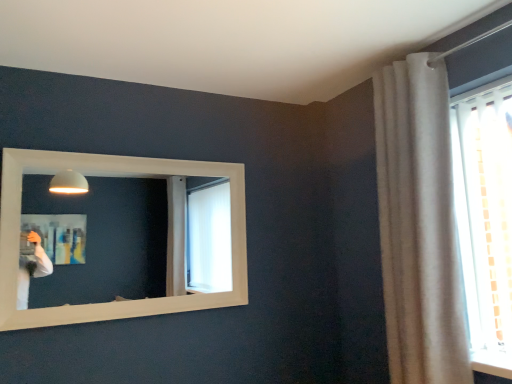
Question: Is white wooden mirror at upper left taller or shorter than white textured curtain at upper right?

Choices:
 (A) tall
 (B) short

Answer: (B)

Question: From a real-world perspective, is white wooden mirror at upper left positioned above or below white textured curtain at upper right?

Choices:
 (A) above
 (B) below

Answer: (A)

Question: Choose the correct answer: Is white wooden mirror at upper left inside white textured curtain at upper right or outside it?

Choices:
 (A) outside
 (B) inside

Answer: (A)

Question: Looking at the image, does white textured curtain at upper right seem bigger or smaller compared to white wooden mirror at upper left?

Choices:
 (A) big
 (B) small

Answer: (A)

Question: Relative to white wooden mirror at upper left, is white textured curtain at upper right in front or behind?

Choices:
 (A) front
 (B) behind

Answer: (A)

Question: From a real-world perspective, relative to white wooden mirror at upper left, is white textured curtain at upper right vertically above or below?

Choices:
 (A) above
 (B) below

Answer: (B)

Question: Is white textured curtain at upper right wider or thinner than white wooden mirror at upper left?

Choices:
 (A) wide
 (B) thin

Answer: (A)